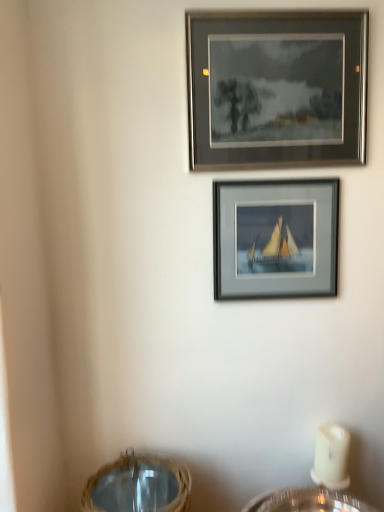
Image resolution: width=384 pixels, height=512 pixels. What do you see at coordinates (275, 238) in the screenshot?
I see `matte gray frame at center, the second picture frame when ordered from top to bottom` at bounding box center [275, 238].

In order to click on matte gray frame at center, the second picture frame when ordered from top to bottom in this screenshot , I will do `click(275, 238)`.

From the image's perspective, is woven straw basket at lower center under matte gray frame at center, the first picture frame when ordered from bottom to top?

Yes.

Do you think woven straw basket at lower center is within matte gray frame at center, the second picture frame when ordered from top to bottom, or outside of it?

woven straw basket at lower center is spatially situated outside matte gray frame at center, the second picture frame when ordered from top to bottom.

Consider the image. Is woven straw basket at lower center behind matte gray frame at center, the second picture frame when ordered from top to bottom?

No, woven straw basket at lower center is closer to the viewer.

Which object is positioned more to the right, woven straw basket at lower center or matte gray frame at center, the first picture frame when ordered from bottom to top?

matte gray frame at center, the first picture frame when ordered from bottom to top.

From a real-world perspective, who is located lower, matte gray frame at center, the second picture frame when ordered from top to bottom, or woven straw basket at lower center?

woven straw basket at lower center, from a real-world perspective.

Can you tell me how much matte gray frame at center, the first picture frame when ordered from bottom to top, and woven straw basket at lower center differ in facing direction?

1 degrees.

Looking at this image, does matte gray frame at center, the first picture frame when ordered from bottom to top, have a greater height compared to woven straw basket at lower center?

Correct, matte gray frame at center, the first picture frame when ordered from bottom to top, is much taller as woven straw basket at lower center.

Which of these two, matte gray frame at center, the second picture frame when ordered from top to bottom, or woven straw basket at lower center, is smaller?

matte gray frame at center, the second picture frame when ordered from top to bottom, is smaller.

In the scene shown: Does matte gray frame at center, the second picture frame when ordered from top to bottom, have a greater height compared to matte gray frame at upper center, marked as the 1th picture frame in a top-to-bottom arrangement?

Incorrect, the height of matte gray frame at center, the second picture frame when ordered from top to bottom, is not larger of that of matte gray frame at upper center, marked as the 1th picture frame in a top-to-bottom arrangement.

From a real-world perspective, is matte gray frame at center, the first picture frame when ordered from bottom to top, physically located above or below matte gray frame at upper center, which is the 2th picture frame in bottom-to-top order?

matte gray frame at center, the first picture frame when ordered from bottom to top, is below matte gray frame at upper center, which is the 2th picture frame in bottom-to-top order.

From the image's perspective, would you say matte gray frame at center, the first picture frame when ordered from bottom to top, is shown under matte gray frame at upper center, which is the 2th picture frame in bottom-to-top order?

Indeed, from the image's perspective, matte gray frame at center, the first picture frame when ordered from bottom to top, is shown beneath matte gray frame at upper center, which is the 2th picture frame in bottom-to-top order.

In the scene shown: Would you say matte gray frame at center, the first picture frame when ordered from bottom to top, is outside matte gray frame at upper center, marked as the 1th picture frame in a top-to-bottom arrangement?

Absolutely, matte gray frame at center, the first picture frame when ordered from bottom to top, is external to matte gray frame at upper center, marked as the 1th picture frame in a top-to-bottom arrangement.

In the scene shown: Which object is positioned more to the left, matte gray frame at upper center, which is the 2th picture frame in bottom-to-top order, or woven straw basket at lower center?

Positioned to the left is woven straw basket at lower center.

Considering the sizes of matte gray frame at upper center, marked as the 1th picture frame in a top-to-bottom arrangement, and woven straw basket at lower center in the image, is matte gray frame at upper center, marked as the 1th picture frame in a top-to-bottom arrangement, wider or thinner than woven straw basket at lower center?

matte gray frame at upper center, marked as the 1th picture frame in a top-to-bottom arrangement, is thinner than woven straw basket at lower center.

Where is `the 2nd picture frame above the woven straw basket at lower center (from a real-world perspective)`? The image size is (384, 512). the 2nd picture frame above the woven straw basket at lower center (from a real-world perspective) is located at coordinates (276, 88).

From the image's perspective, between matte gray frame at upper center, marked as the 1th picture frame in a top-to-bottom arrangement, and woven straw basket at lower center, which one is located above?

matte gray frame at upper center, marked as the 1th picture frame in a top-to-bottom arrangement, appears higher in the image.

Between woven straw basket at lower center and matte gray frame at upper center, marked as the 1th picture frame in a top-to-bottom arrangement, which one has smaller size?

With smaller size is matte gray frame at upper center, marked as the 1th picture frame in a top-to-bottom arrangement.

Locate an element on the screen. The width and height of the screenshot is (384, 512). basket that appears below the matte gray frame at upper center, marked as the 1th picture frame in a top-to-bottom arrangement (from a real-world perspective) is located at coordinates (138, 486).

What's the angular difference between woven straw basket at lower center and matte gray frame at upper center, which is the 2th picture frame in bottom-to-top order,'s facing directions?

The facing directions of woven straw basket at lower center and matte gray frame at upper center, which is the 2th picture frame in bottom-to-top order, are 1 degrees apart.

From the image's perspective, which is above, woven straw basket at lower center or matte gray frame at upper center, which is the 2th picture frame in bottom-to-top order?

matte gray frame at upper center, which is the 2th picture frame in bottom-to-top order, appears higher in the image.

From a real-world perspective, is matte gray frame at upper center, marked as the 1th picture frame in a top-to-bottom arrangement, on matte gray frame at center, the second picture frame when ordered from top to bottom?

Yes, from a real-world perspective, matte gray frame at upper center, marked as the 1th picture frame in a top-to-bottom arrangement, is over matte gray frame at center, the second picture frame when ordered from top to bottom

Is matte gray frame at upper center, which is the 2th picture frame in bottom-to-top order, far from matte gray frame at center, the second picture frame when ordered from top to bottom?

No.

Does matte gray frame at upper center, which is the 2th picture frame in bottom-to-top order, contain matte gray frame at center, the second picture frame when ordered from top to bottom?

No, matte gray frame at center, the second picture frame when ordered from top to bottom, is not inside matte gray frame at upper center, which is the 2th picture frame in bottom-to-top order.

Does matte gray frame at upper center, marked as the 1th picture frame in a top-to-bottom arrangement, lie in front of matte gray frame at center, the first picture frame when ordered from bottom to top?

Yes, it is in front of matte gray frame at center, the first picture frame when ordered from bottom to top.

Identify the location of the 2nd picture frame behind the woven straw basket at lower center. (275, 238).

This screenshot has height=512, width=384. There is a woven straw basket at lower center. In order to click on the 1st picture frame above it (from the image's perspective) in this screenshot , I will do `click(275, 238)`.

Estimate the real-world distances between objects in this image. Which object is further from matte gray frame at center, the first picture frame when ordered from bottom to top, matte gray frame at upper center, which is the 2th picture frame in bottom-to-top order, or woven straw basket at lower center?

woven straw basket at lower center.

When comparing their distances from matte gray frame at center, the first picture frame when ordered from bottom to top, does woven straw basket at lower center or matte gray frame at upper center, which is the 2th picture frame in bottom-to-top order, seem further?

Among the two, woven straw basket at lower center is located further to matte gray frame at center, the first picture frame when ordered from bottom to top.

From the image, which object appears to be nearer to woven straw basket at lower center, matte gray frame at upper center, which is the 2th picture frame in bottom-to-top order, or matte gray frame at center, the second picture frame when ordered from top to bottom?

matte gray frame at center, the second picture frame when ordered from top to bottom.

Which object lies nearer to the anchor point matte gray frame at upper center, which is the 2th picture frame in bottom-to-top order, woven straw basket at lower center or matte gray frame at center, the second picture frame when ordered from top to bottom?

The object closer to matte gray frame at upper center, which is the 2th picture frame in bottom-to-top order, is matte gray frame at center, the second picture frame when ordered from top to bottom.

Which object lies further to the anchor point matte gray frame at upper center, marked as the 1th picture frame in a top-to-bottom arrangement, matte gray frame at center, the first picture frame when ordered from bottom to top, or woven straw basket at lower center?

Based on the image, woven straw basket at lower center appears to be further to matte gray frame at upper center, marked as the 1th picture frame in a top-to-bottom arrangement.

Estimate the real-world distances between objects in this image. Which object is closer to woven straw basket at lower center, matte gray frame at center, the first picture frame when ordered from bottom to top, or matte gray frame at upper center, marked as the 1th picture frame in a top-to-bottom arrangement?

matte gray frame at center, the first picture frame when ordered from bottom to top, lies closer to woven straw basket at lower center than the other object.

You are a GUI agent. You are given a task and a screenshot of the screen. Output one action in this format:
    pyautogui.click(x=<x>, y=<y>)
    Task: Click on the picture frame between matte gray frame at upper center, which is the 2th picture frame in bottom-to-top order, and woven straw basket at lower center in the up-down direction
    This screenshot has height=512, width=384.
    Given the screenshot: What is the action you would take?
    pyautogui.click(x=275, y=238)